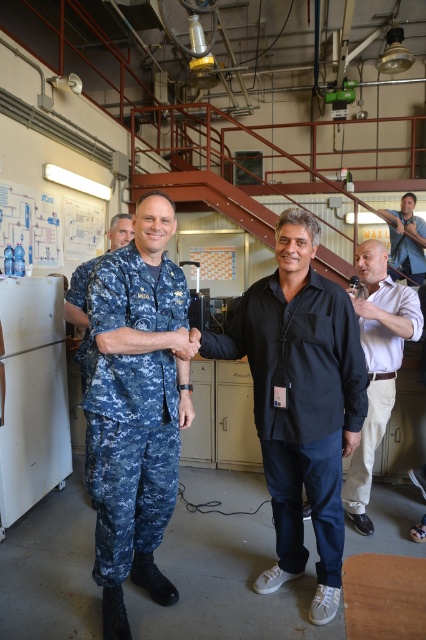
Does point (307, 392) come in front of point (103, 515)?

Yes, it is in front of point (103, 515).

Does black cotton shirt at center have a greater width compared to digital camouflage uniform at center?

Correct, the width of black cotton shirt at center exceeds that of digital camouflage uniform at center.

Where is `black cotton shirt at center`? The height and width of the screenshot is (640, 426). black cotton shirt at center is located at coordinates (301, 404).

Who is higher up, black cotton shirt at center or khaki cotton pants at right?

Positioned higher is khaki cotton pants at right.

Between black cotton shirt at center and khaki cotton pants at right, which one has less height?

black cotton shirt at center

This screenshot has width=426, height=640. I want to click on black cotton shirt at center, so click(301, 404).

From the picture: Can you confirm if digital camouflage uniform at center is positioned above blue denim shirt at upper right?

Incorrect, digital camouflage uniform at center is not positioned above blue denim shirt at upper right.

Between point (175, 323) and point (409, 200), which one is positioned in front?

Point (175, 323) is more forward.

Does point (160, 486) come in front of point (402, 250)?

Yes, it is.

Where is `digital camouflage uniform at center`? The height and width of the screenshot is (640, 426). digital camouflage uniform at center is located at coordinates (131, 410).